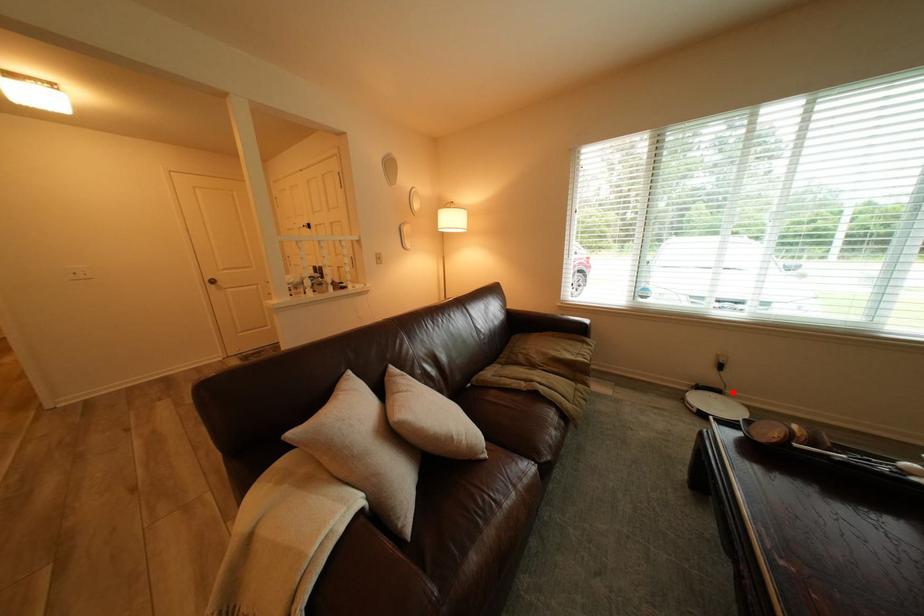
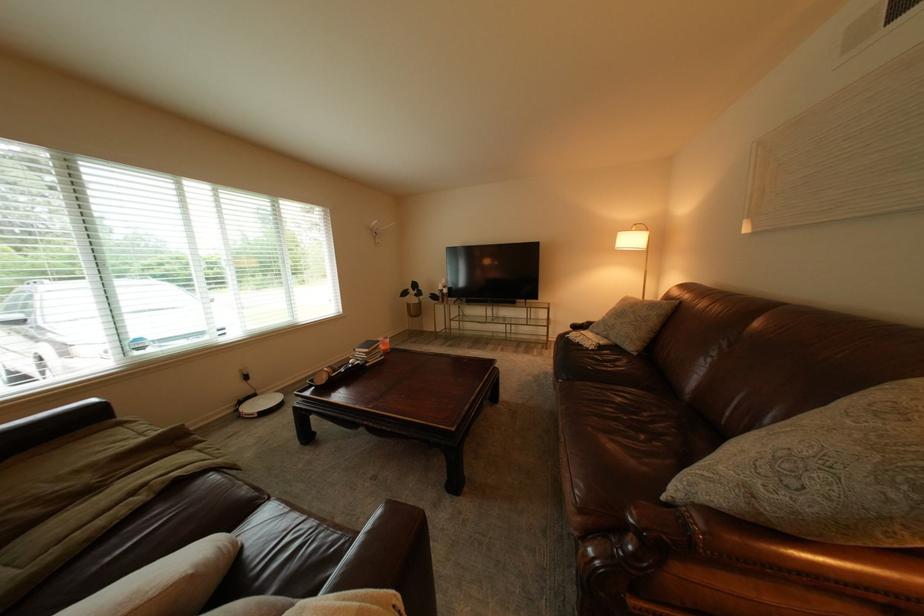
In the second image, find the point that corresponds to the highlighted location in the first image.

(269, 397)